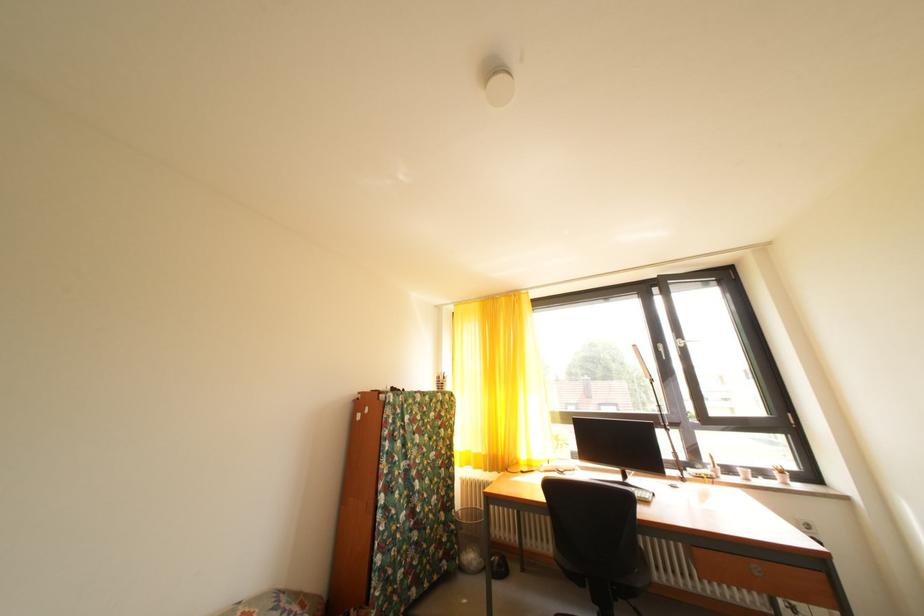
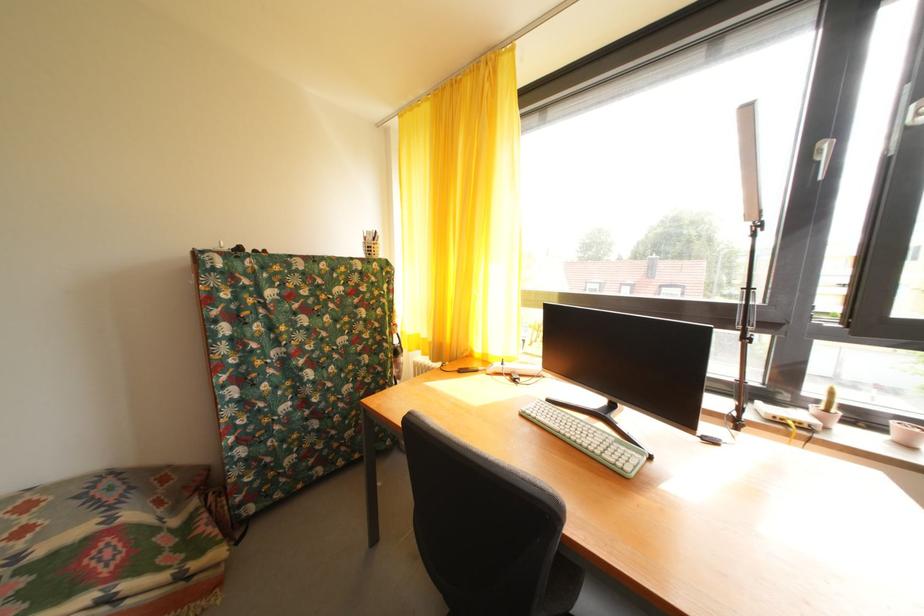
In the second image, find the point that corresponds to [484,461] in the first image.

(432, 346)